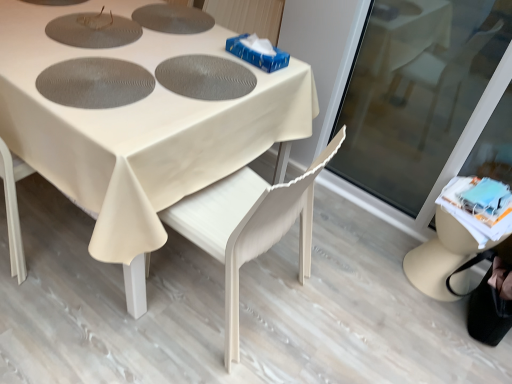
Identify the location of vacant space to the left of transparent glass screen door at lower right. The width and height of the screenshot is (512, 384). (349, 224).